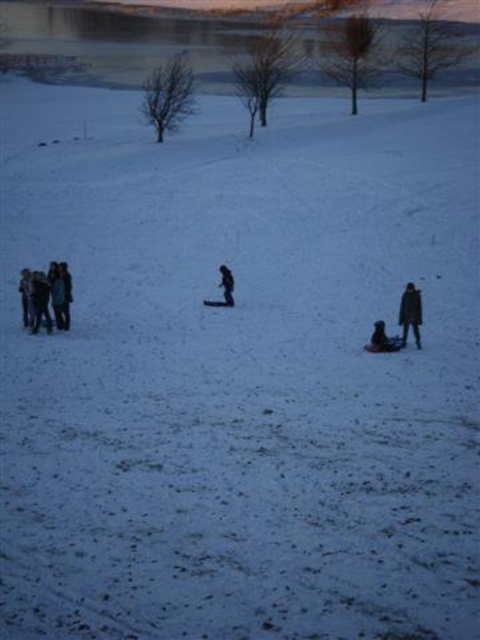
You are a photographer trying to capture a photo of the brown wool coat at right and the black matte jacket at center in the snowy landscape. Based on their positions, which object should you focus on first to ensure both are in sharp focus?

The brown wool coat at right is below the black matte jacket at center, so you should focus on the black matte jacket at center first since it is closer to the camera, ensuring both will be in focus when using depth of field appropriately.